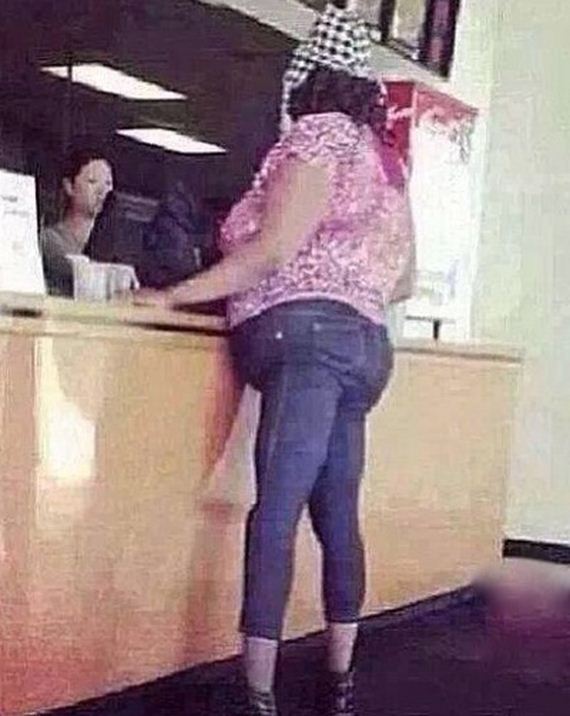
Find the location of `ceiling lights`. ceiling lights is located at coordinates (179, 142), (133, 86).